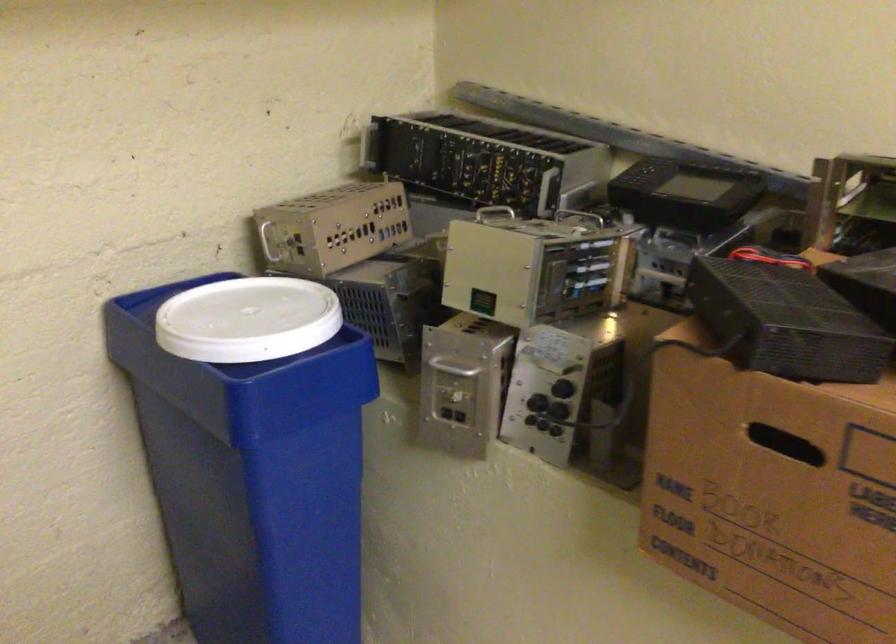
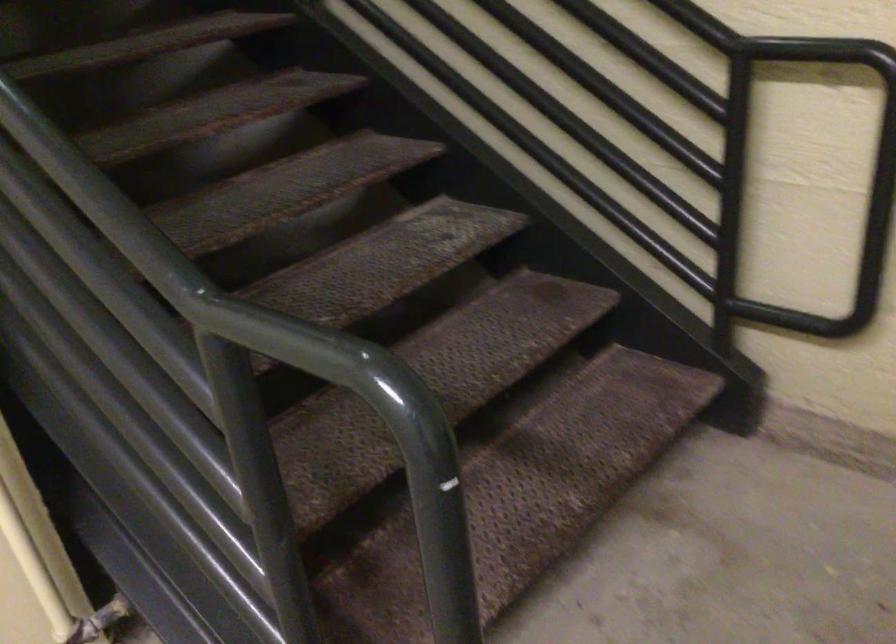
Based on the continuous images, in which direction is the camera rotating?

The camera's rotation is toward left-down.